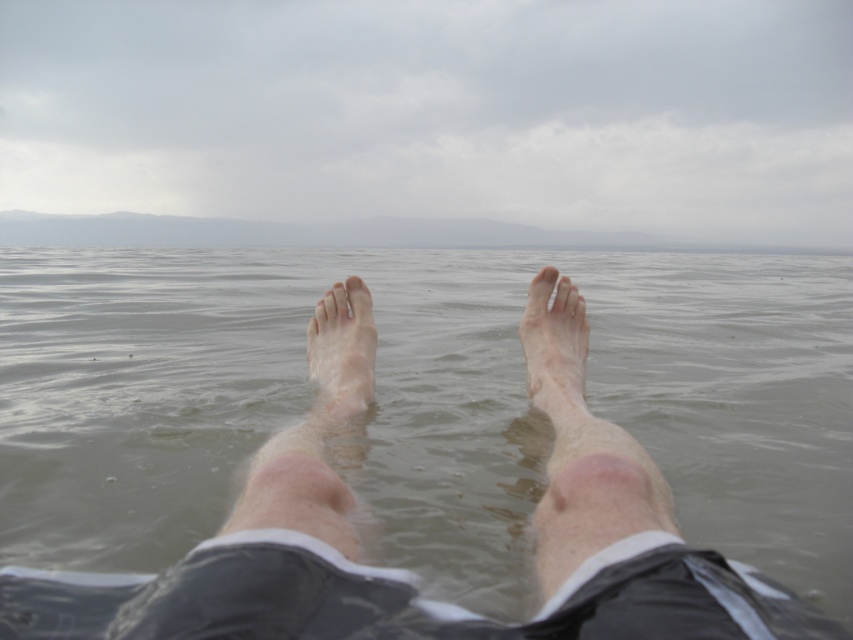
Can you confirm if dry skin foot at center is taller than pale skin foot at center?

Yes, dry skin foot at center is taller than pale skin foot at center.

Is dry skin foot at center behind pale skin foot at center?

No.

Which is in front, point (543, 316) or point (318, 397)?

Point (318, 397)

What are the coordinates of `dry skin foot at center` in the screenshot? It's located at (555, 348).

Which of these two, clear water at feet center or pale skin foot at center, stands shorter?

With less height is pale skin foot at center.

How far apart are clear water at feet center and pale skin foot at center?

They are 9.35 feet apart.

Measure the distance between clear water at feet center and camera.

The distance of clear water at feet center from camera is 1.24 meters.

At what (x,y) coordinates should I click in order to perform the action: click on clear water at feet center. Please return your answer as a coordinate pair (x, y). This screenshot has width=853, height=640. Looking at the image, I should click on (421, 401).

Can you confirm if dry skin leg at center is positioned below pale skin foot at center?

Yes, dry skin leg at center is below pale skin foot at center.

Between point (560, 381) and point (358, 381), which one is positioned in front?

Point (560, 381)

Which is in front, point (566, 477) or point (354, 403)?

Positioned in front is point (566, 477).

In order to click on dry skin leg at center in this screenshot , I will do `click(579, 444)`.